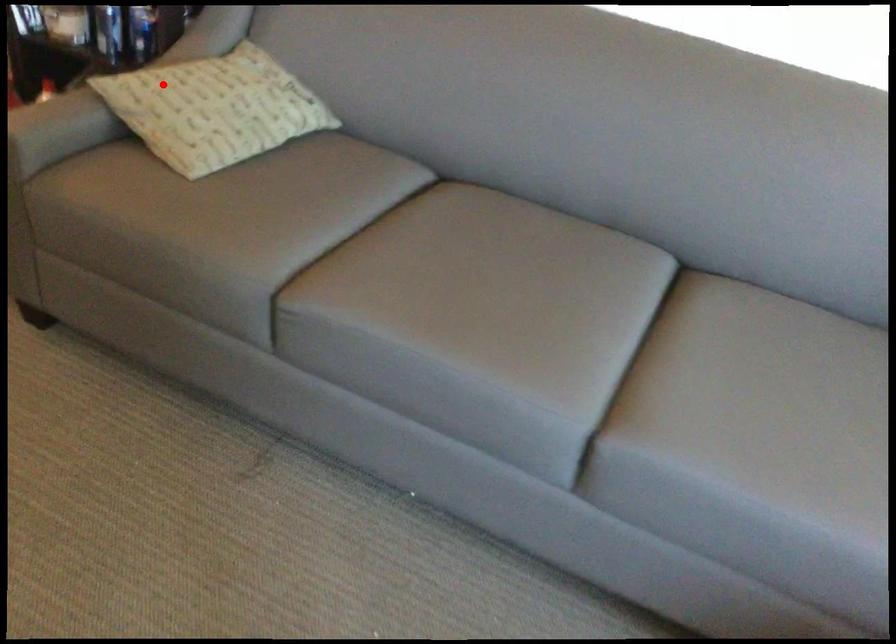
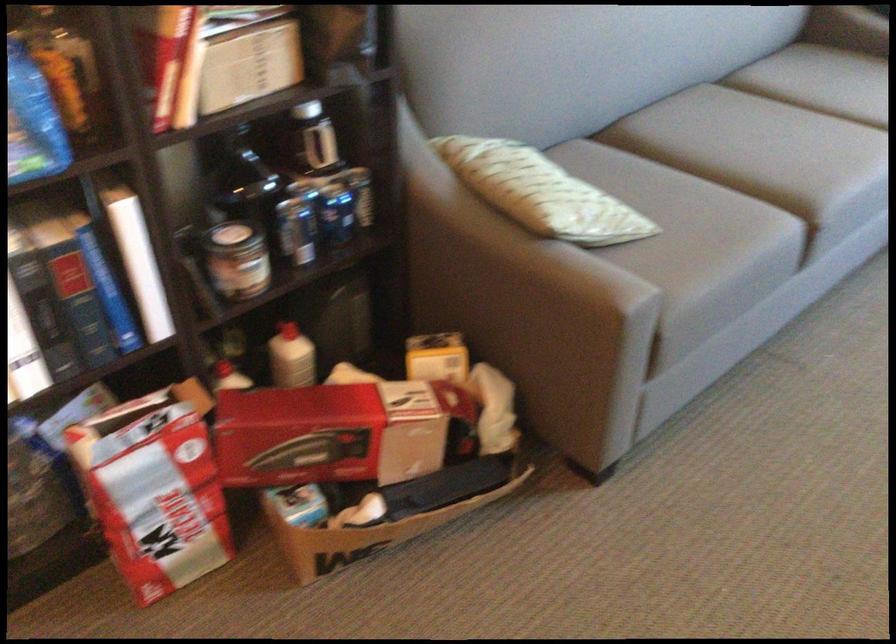
In the second image, find the point that corresponds to the highlighted location in the first image.

(537, 192)